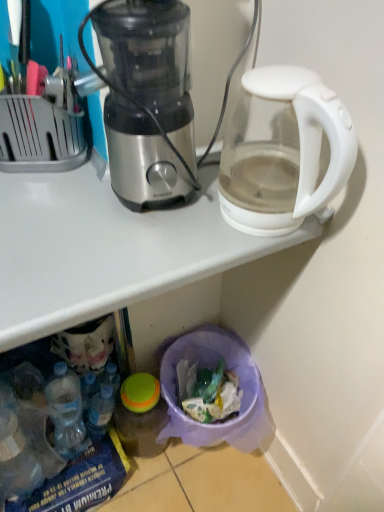
Question: From the image's perspective, relative to translucent plastic trash can at lower center, is translucent plastic bottle at lower left above or below?

Choices:
 (A) above
 (B) below

Answer: (A)

Question: Considering their positions, is translucent plastic bottle at lower left located in front of or behind translucent plastic trash can at lower center?

Choices:
 (A) behind
 (B) front

Answer: (A)

Question: Which is farther from the translucent plastic bottle at lower left?

Choices:
 (A) transparent plastic trash bin at lower center
 (B) stainless steel blender at center
 (C) translucent plastic trash can at lower center
 (D) transparent glass kettle at upper right

Answer: (D)

Question: Which is nearer to the translucent plastic bottle at lower left?

Choices:
 (A) transparent plastic trash bin at lower center
 (B) transparent glass kettle at upper right
 (C) stainless steel blender at center
 (D) translucent plastic trash can at lower center

Answer: (D)